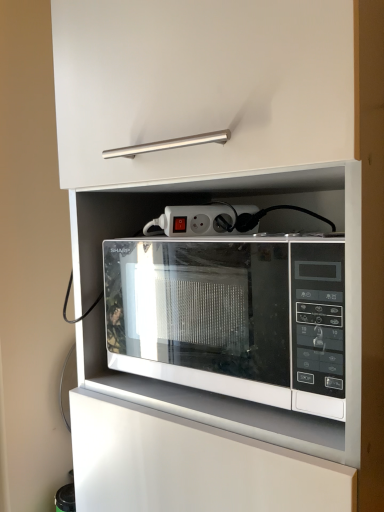
You are a GUI agent. You are given a task and a screenshot of the screen. Output one action in this format:
    pyautogui.click(x=<x>, y=<y>)
    Task: Click on the white plastic power strip at center
    This screenshot has width=384, height=512.
    Given the screenshot: What is the action you would take?
    pyautogui.click(x=195, y=218)

The width and height of the screenshot is (384, 512). Describe the element at coordinates (195, 218) in the screenshot. I see `white plastic power strip at center` at that location.

What are the coordinates of `white glossy microwave at center` in the screenshot? It's located at (231, 318).

This screenshot has width=384, height=512. Describe the element at coordinates (231, 318) in the screenshot. I see `white glossy microwave at center` at that location.

The width and height of the screenshot is (384, 512). In order to click on white plastic power strip at center in this screenshot , I will do `click(195, 218)`.

Between white plastic power strip at center and white glossy microwave at center, which one appears on the left side from the viewer's perspective?

white plastic power strip at center is more to the left.

Relative to white glossy microwave at center, is white plastic power strip at center in front or behind?

white plastic power strip at center is behind white glossy microwave at center.

Does point (194, 228) come closer to viewer compared to point (130, 332)?

Yes.

From the image's perspective, would you say white plastic power strip at center is positioned over white glossy microwave at center?

Yes, from the image's perspective, white plastic power strip at center is on top of white glossy microwave at center.

From a real-world perspective, is white plastic power strip at center physically located above or below white glossy microwave at center?

white plastic power strip at center is situated higher than white glossy microwave at center in the real world.

Based on the photo, considering the sizes of objects white plastic power strip at center and white glossy microwave at center in the image provided, who is wider, white plastic power strip at center or white glossy microwave at center?

With larger width is white glossy microwave at center.

Which of these two, white plastic power strip at center or white glossy microwave at center, stands taller?

white glossy microwave at center is taller.

Between white plastic power strip at center and white glossy microwave at center, which one has larger size?

Bigger between the two is white glossy microwave at center.

Is white plastic power strip at center inside or outside of white glossy microwave at center?

white plastic power strip at center cannot be found inside white glossy microwave at center.

Consider the image. Is white plastic power strip at center directly adjacent to white glossy microwave at center?

No, white plastic power strip at center is not next to white glossy microwave at center.

Could you tell me if white plastic power strip at center is facing white glossy microwave at center?

No, white plastic power strip at center is not oriented towards white glossy microwave at center.

Identify the location of microwave oven on the right of the white plastic power strip at center. Image resolution: width=384 pixels, height=512 pixels. (231, 318).

Which object is positioned more to the right, white glossy microwave at center or white plastic power strip at center?

From the viewer's perspective, white glossy microwave at center appears more on the right side.

Is white glossy microwave at center positioned in front of white plastic power strip at center?

Yes, it is.

Which point is more forward, (191,246) or (171,215)?

The point (171,215) is more forward.

From the image's perspective, which is below, white glossy microwave at center or white plastic power strip at center?

From the image's view, white glossy microwave at center is below.

From a real-world perspective, is white glossy microwave at center over white plastic power strip at center?

Incorrect, from a real-world perspective, white glossy microwave at center is lower than white plastic power strip at center.

Can you confirm if white glossy microwave at center is wider than white plastic power strip at center?

Indeed, white glossy microwave at center has a greater width compared to white plastic power strip at center.

Considering the sizes of white glossy microwave at center and white plastic power strip at center in the image, is white glossy microwave at center taller or shorter than white plastic power strip at center?

Clearly, white glossy microwave at center is taller compared to white plastic power strip at center.

Which of these two, white glossy microwave at center or white plastic power strip at center, is bigger?

With larger size is white glossy microwave at center.

Can white plastic power strip at center be found inside white glossy microwave at center?

Actually, white plastic power strip at center is outside white glossy microwave at center.

Would you consider white glossy microwave at center to be distant from white plastic power strip at center?

No, white glossy microwave at center is not far away from white plastic power strip at center.

Is white glossy microwave at center facing away from white plastic power strip at center?

No, white glossy microwave at center is not facing away from white plastic power strip at center.

What's the angular difference between white glossy microwave at center and white plastic power strip at center's facing directions?

There is a 38.6-degree angle between the facing directions of white glossy microwave at center and white plastic power strip at center.

Measure the distance between white glossy microwave at center and white plastic power strip at center.

They are 12.51 inches apart.

Locate an element on the screen. The width and height of the screenshot is (384, 512). electric outlet behind the white glossy microwave at center is located at coordinates (195, 218).

Where is `electric outlet on the left of the white glossy microwave at center`? The image size is (384, 512). electric outlet on the left of the white glossy microwave at center is located at coordinates (195, 218).

Locate an element on the screen. This screenshot has height=512, width=384. microwave oven that is on the right side of white plastic power strip at center is located at coordinates (231, 318).